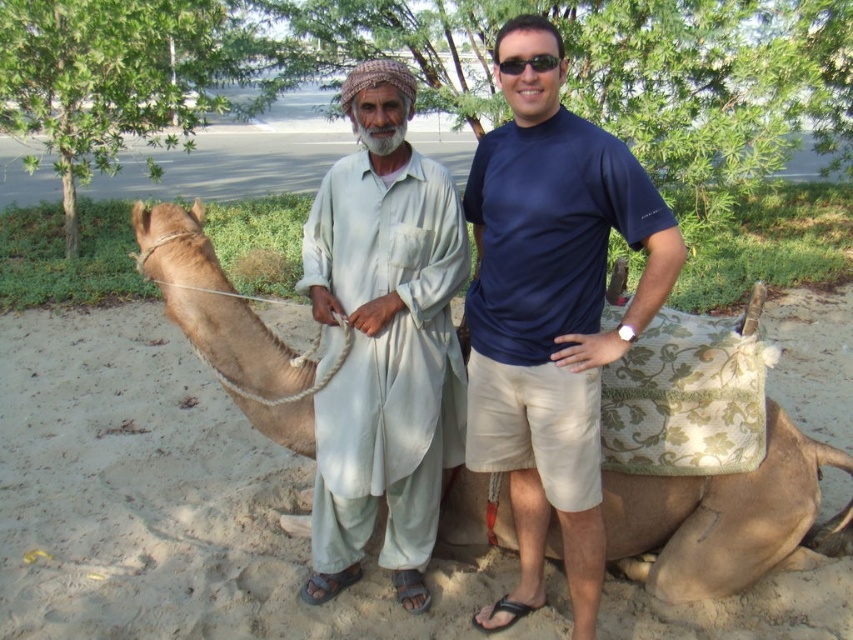
Question: Estimate the real-world distances between objects in this image. Which object is farther from the blue cotton t-shirt at center?

Choices:
 (A) light beige fabric at center
 (B) light brown camel at center

Answer: (B)

Question: Can you confirm if blue cotton t-shirt at center is positioned below light beige fabric at center?

Choices:
 (A) yes
 (B) no

Answer: (A)

Question: Which of the following is the farthest from the observer?

Choices:
 (A) [764, 561]
 (B) [583, 385]
 (C) [337, 586]
 (D) [537, 60]

Answer: (C)

Question: Which of the following is the farthest from the observer?

Choices:
 (A) [436, 380]
 (B) [614, 493]
 (C) [682, 248]
 (D) [503, 61]

Answer: (B)

Question: Is light beige fabric at center closer to camera compared to light brown camel at center?

Choices:
 (A) no
 (B) yes

Answer: (B)

Question: In this image, where is light brown camel at center located relative to black plastic sunglasses at center?

Choices:
 (A) above
 (B) below

Answer: (B)